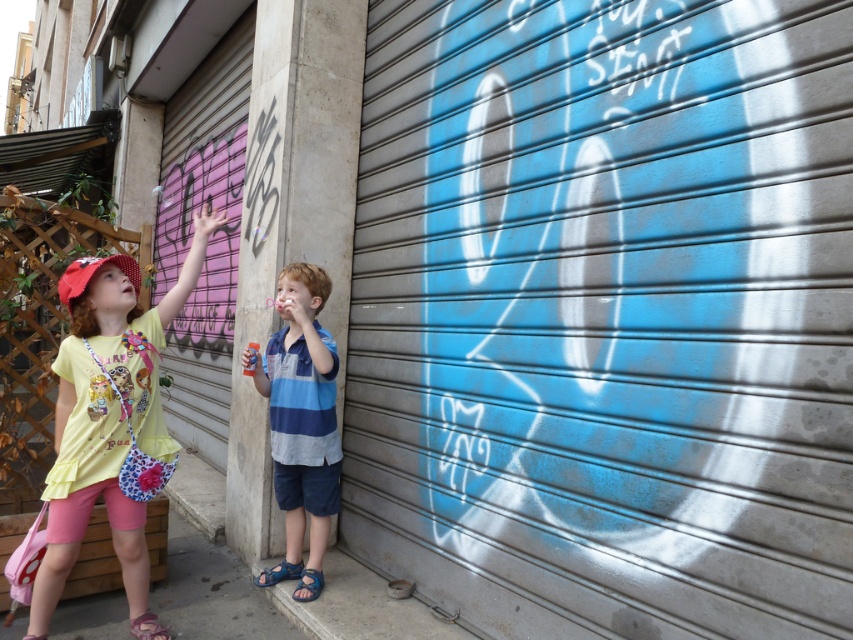
Question: Which point is closer to the camera?

Choices:
 (A) (152, 444)
 (B) (798, 42)
 (C) (276, 356)

Answer: (B)

Question: Does metallic silver garage door at center lie behind yellow fabric shirt at upper left?

Choices:
 (A) no
 (B) yes

Answer: (A)

Question: Does yellow fabric shirt at upper left appear on the left side of blue striped shirt at center?

Choices:
 (A) yes
 (B) no

Answer: (A)

Question: Does metallic silver garage door at center appear over yellow fabric shirt at upper left?

Choices:
 (A) no
 (B) yes

Answer: (B)

Question: Which of these objects is positioned closest to the yellow fabric shirt at upper left?

Choices:
 (A) metallic silver garage door at center
 (B) blue striped shirt at center

Answer: (B)

Question: Which point is farther to the camera?

Choices:
 (A) yellow fabric shirt at upper left
 (B) metallic silver garage door at center
 (C) blue striped shirt at center

Answer: (C)